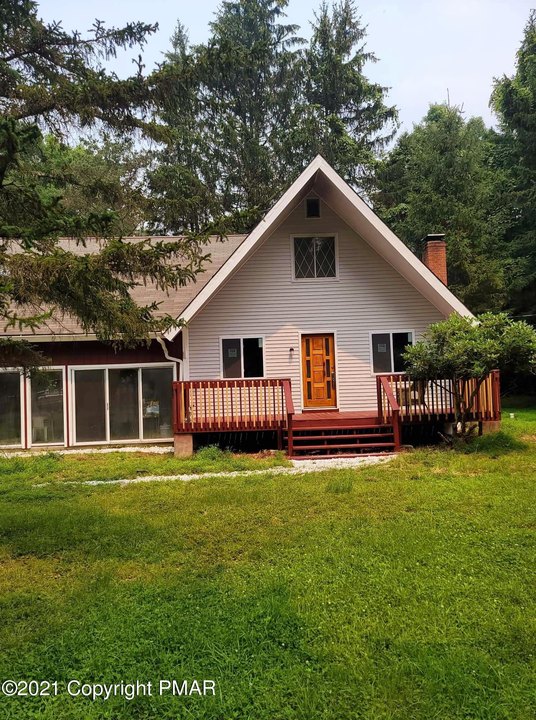
Find the location of a particular element. This screenshot has height=720, width=536. patio door is located at coordinates (107, 418), (150, 414), (47, 417).